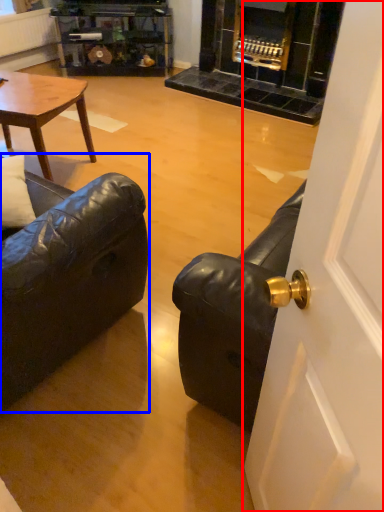
Question: Which object is closer to the camera taking this photo, door (highlighted by a red box) or studio couch (highlighted by a blue box)?

Choices:
 (A) door
 (B) studio couch

Answer: (A)